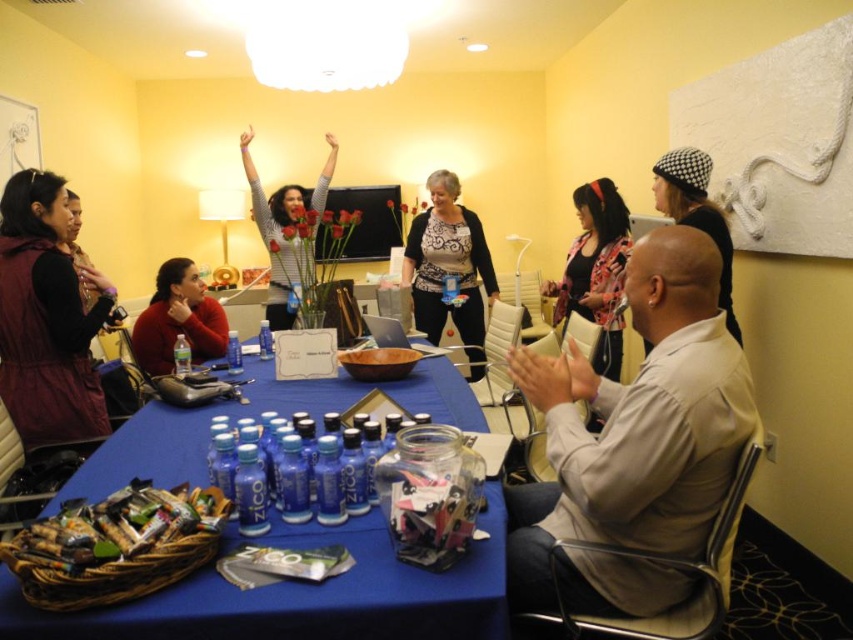
What are the coordinates of the beige fabric shirt at lower right?

The beige fabric shirt at lower right is located at coordinates point (633, 444).

You are standing in the conference room and want to pick up the brown woven basket at lower left. To reach it, you need to move around the table. Which direction should you move relative to the beige fabric shirt at lower right?

You should move away from the beige fabric shirt at lower right because the brown woven basket at lower left is closer to you than the shirt, so moving towards the basket would require going in the opposite direction of the shirt.